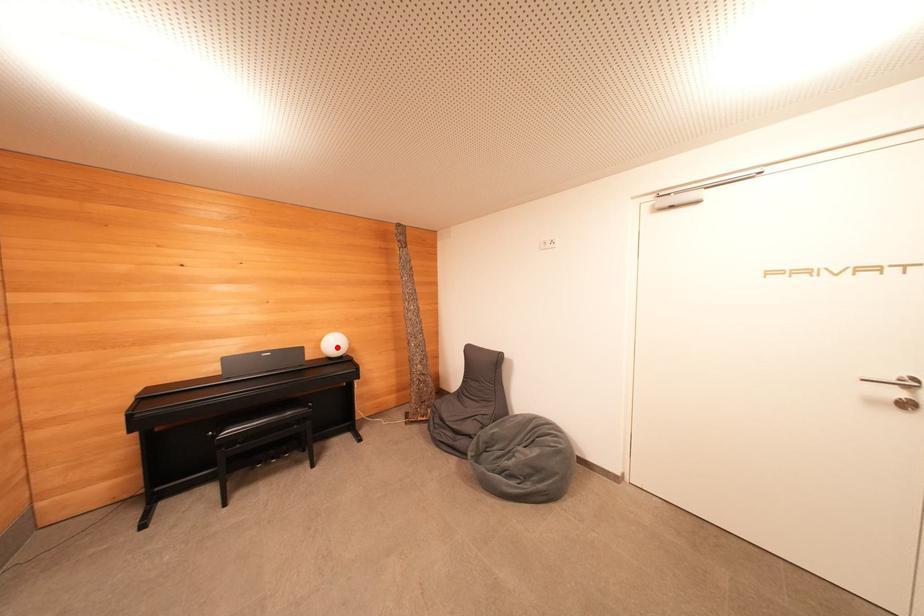
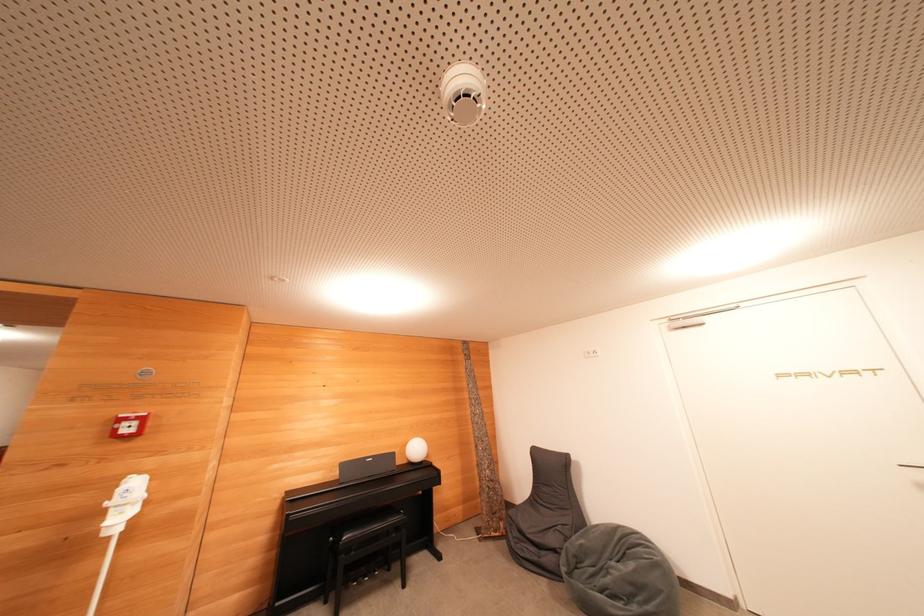
Question: I am providing you with two images of the same scene from different viewpoints. In image1, a red point is highlighted. Considering the same 3D point in image2, which of the following is correct?

Choices:
 (A) It is closer
 (B) It is farther

Answer: (B)